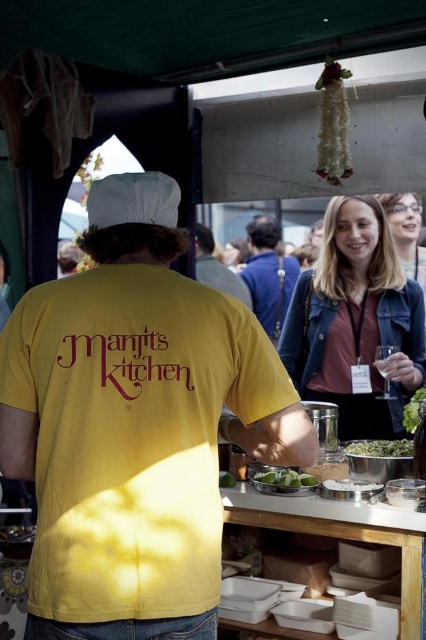
Question: Is denim jacket at upper right above green leafy at center?

Choices:
 (A) yes
 (B) no

Answer: (A)

Question: Which of these objects is positioned farthest from the yellow fabric shirt at center?

Choices:
 (A) blonde hair at upper center
 (B) blue denim jacket at center

Answer: (A)

Question: Which of these objects is positioned closest to the green leafy at center?

Choices:
 (A) yellow fabric shirt at center
 (B) denim jacket at upper right
 (C) green matte limes at center

Answer: (C)

Question: Does matte gray shirt at center have a lesser width compared to green matte limes at center?

Choices:
 (A) yes
 (B) no

Answer: (B)

Question: Which point is farther to the camera?

Choices:
 (A) blonde hair at upper center
 (B) yellow fabric shirt at center
 (C) green leafy at center

Answer: (A)

Question: Is denim jacket at upper right thinner than blue denim jacket at center?

Choices:
 (A) yes
 (B) no

Answer: (B)